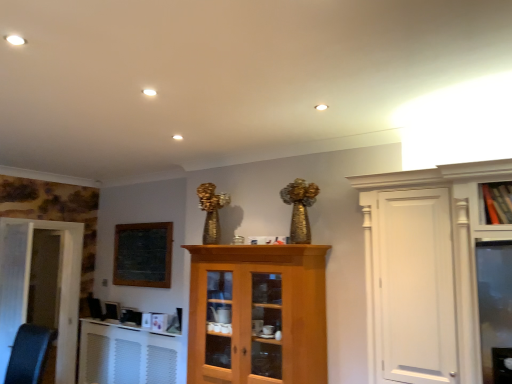
Question: Is wooden cabinet at upper right turned away from white textured radiator at lower left?

Choices:
 (A) yes
 (B) no

Answer: (B)

Question: Does wooden cabinet at upper right turn towards white textured radiator at lower left?

Choices:
 (A) yes
 (B) no

Answer: (B)

Question: Would you say wooden cabinet at upper right is a long distance from white textured radiator at lower left?

Choices:
 (A) no
 (B) yes

Answer: (B)

Question: Can you confirm if wooden cabinet at upper right is shorter than white textured radiator at lower left?

Choices:
 (A) yes
 (B) no

Answer: (A)

Question: From a real-world perspective, is wooden cabinet at upper right physically above white textured radiator at lower left?

Choices:
 (A) yes
 (B) no

Answer: (A)

Question: Looking at the image, does white glossy door at left, which appears as the first door when viewed from the back, seem bigger or smaller compared to black leather swivel chair at lower left?

Choices:
 (A) small
 (B) big

Answer: (B)

Question: In the image, is white glossy door at left, which appears as the first door when viewed from the back, positioned in front of or behind black leather swivel chair at lower left?

Choices:
 (A) behind
 (B) front

Answer: (A)

Question: Is white glossy door at left, which appears as the first door when viewed from the back, situated inside black leather swivel chair at lower left or outside?

Choices:
 (A) outside
 (B) inside

Answer: (A)

Question: From a real-world perspective, is white glossy door at left, which appears as the first door when viewed from the back, positioned above or below black leather swivel chair at lower left?

Choices:
 (A) below
 (B) above

Answer: (B)

Question: From a real-world perspective, is white glossy door at left, which appears as the first door when viewed from the back, above or below white textured radiator at lower left?

Choices:
 (A) below
 (B) above

Answer: (B)

Question: Does point (33, 294) appear closer or farther from the camera than point (100, 374)?

Choices:
 (A) closer
 (B) farther

Answer: (B)

Question: Considering the positions of white glossy door at left, which appears as the first door when viewed from the back, and white textured radiator at lower left in the image, is white glossy door at left, which appears as the first door when viewed from the back, bigger or smaller than white textured radiator at lower left?

Choices:
 (A) big
 (B) small

Answer: (A)

Question: Looking at their shapes, would you say white glossy door at left, which is the 2th door in front-to-back order, is wider or thinner than white textured radiator at lower left?

Choices:
 (A) wide
 (B) thin

Answer: (A)

Question: Looking at their shapes, would you say white textured radiator at lower left is wider or thinner than wooden cabinet at upper right?

Choices:
 (A) thin
 (B) wide

Answer: (B)

Question: Relative to wooden cabinet at upper right, is white textured radiator at lower left in front or behind?

Choices:
 (A) behind
 (B) front

Answer: (A)